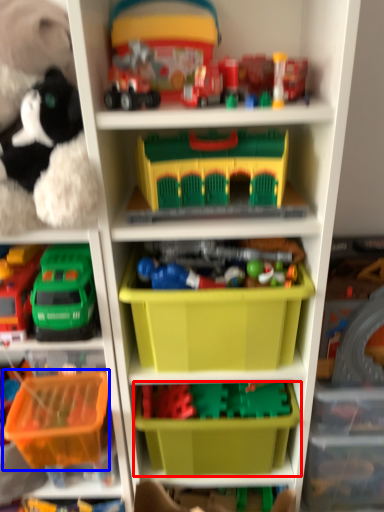
Question: Which point is further to the camera, storage box (highlighted by a red box) or storage box (highlighted by a blue box)?

Choices:
 (A) storage box
 (B) storage box

Answer: (A)